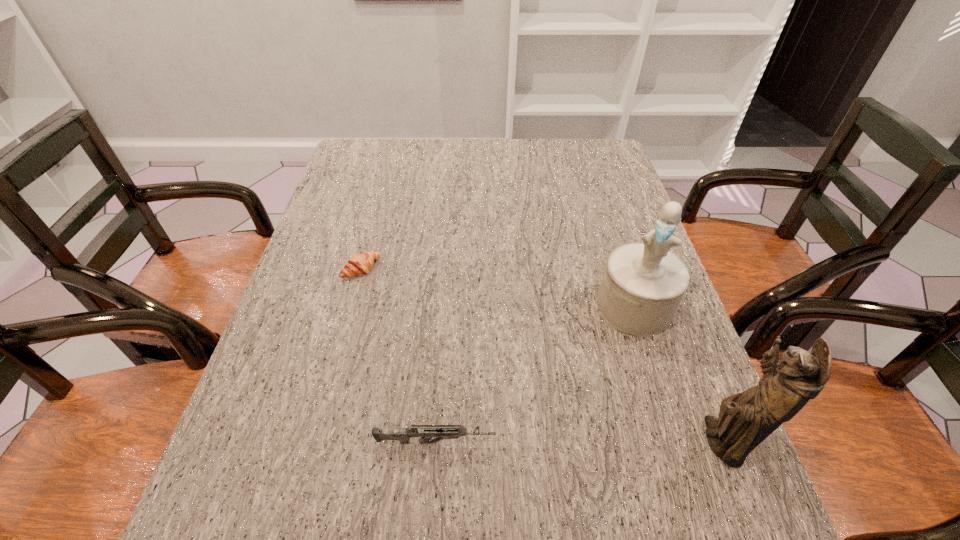
Find the location of `vacant spot on the desktop that is between the second shortest object and the nearer figurine and is positioned at the beak of the farther figurine`. vacant spot on the desktop that is between the second shortest object and the nearer figurine and is positioned at the beak of the farther figurine is located at coordinates (577, 442).

At what (x,y) coordinates should I click in order to perform the action: click on free space on the desktop that is between the third tallest object and the nearer figurine and is positioned on the front-facing side of the leftmost object. Please return your answer as a coordinate pair (x, y). The width and height of the screenshot is (960, 540). Looking at the image, I should click on (564, 442).